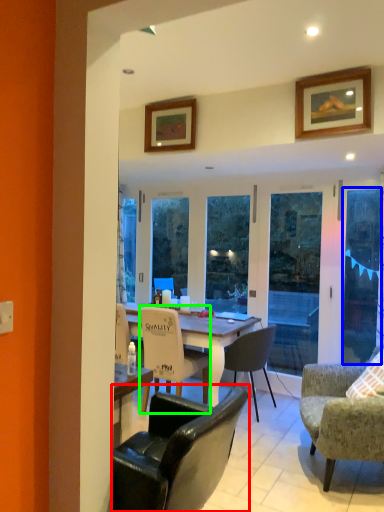
Question: Which object is the farthest from chair (highlighted by a red box)? Choose among these: screen door (highlighted by a blue box) or chair (highlighted by a green box).

Choices:
 (A) screen door
 (B) chair

Answer: (A)